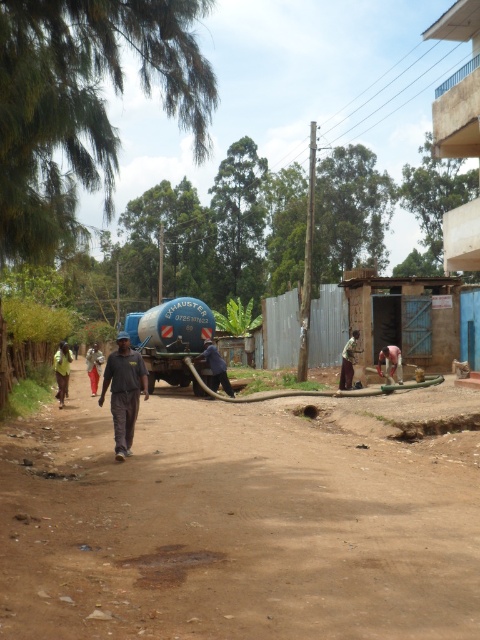
From the picture: You are a pedestrian standing on the dirt road and see the light brown fabric shirt at lower right and the dark gray fabric pants at center. Which person is closer to you?

The light brown fabric shirt at lower right is closer to you because it is in front of the dark gray fabric pants at center.

From the picture: You are a delivery driver who needs to park your vehicle near the blue corrugated metal hut at upper right and the light brown fabric shirt at lower right. Based on the scene, where should you park your vehicle to be closest to both locations?

The blue corrugated metal hut at upper right is above the light brown fabric shirt at lower right, so parking between them would place you closest to both locations.

You are a photographer trying to capture the scene with a camera. You notice the light brown fabric shirt at lower right and the dark gray fabric pants at center. Which of the two items is taller in the photo?

The light brown fabric shirt at lower right has a greater height compared to the dark gray fabric pants at center, so the light brown fabric shirt at lower right is taller in the photo.